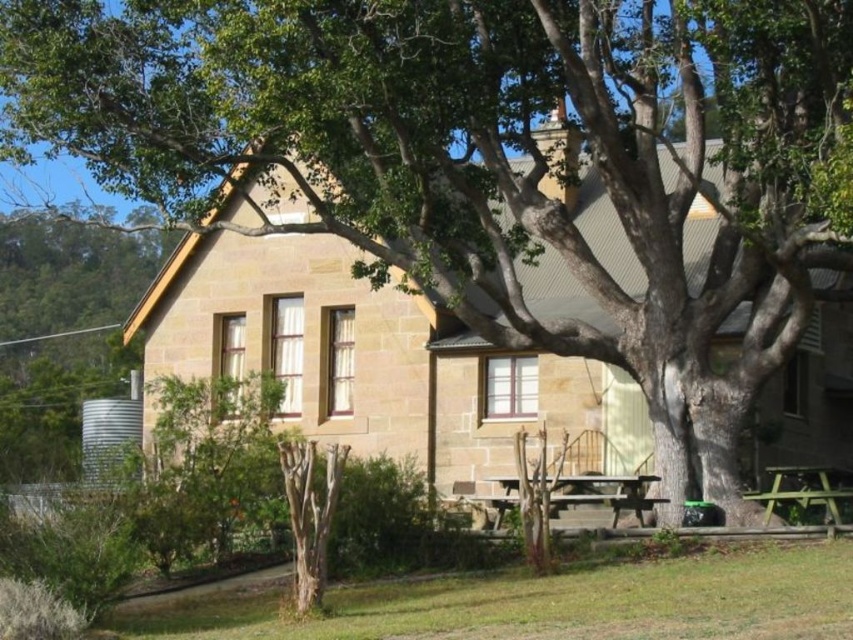
You are planning a picnic and see the wooden picnic table at center and the green wooden picnic table at lower right in the image. Which table is positioned higher relative to the other?

The wooden picnic table at center is above the green wooden picnic table at lower right, so it is positioned higher.